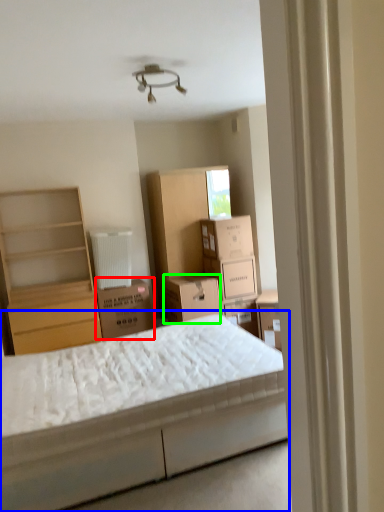
Question: Considering the real-world distances, which object is farthest from cardboard box (highlighted by a red box)? bed (highlighted by a blue box) or storage box (highlighted by a green box)?

Choices:
 (A) bed
 (B) storage box

Answer: (A)